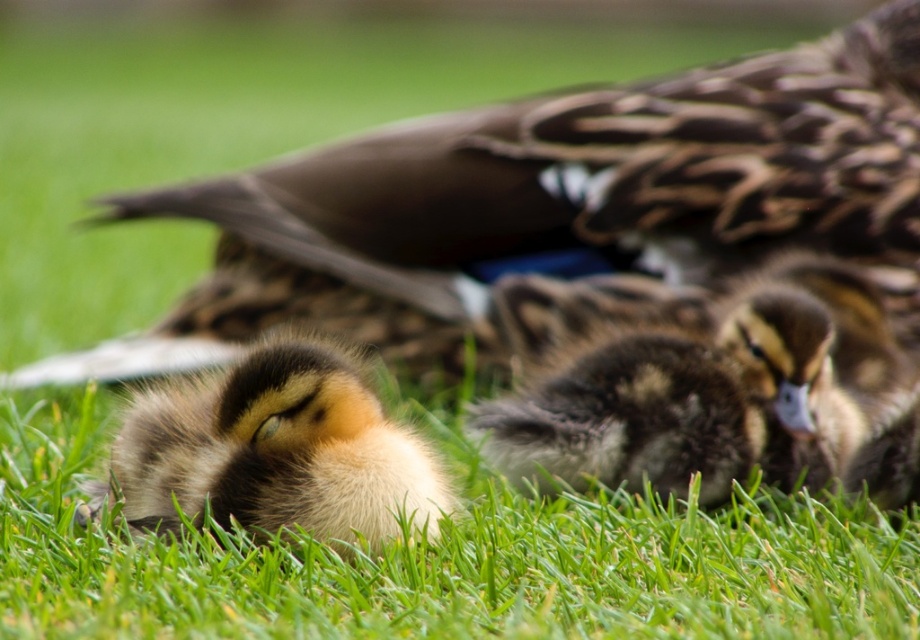
Question: Which of the following is the closest to the observer?

Choices:
 (A) (843, 460)
 (B) (273, 513)

Answer: (B)

Question: Which object appears farthest from the camera in this image?

Choices:
 (A) brown fluffy duckling at center
 (B) soft brown downy duckling at lower left

Answer: (A)

Question: Is brown fluffy duckling at center to the left of soft brown downy duckling at lower left from the viewer's perspective?

Choices:
 (A) no
 (B) yes

Answer: (A)

Question: Can you confirm if brown fluffy duckling at center is bigger than soft brown downy duckling at lower left?

Choices:
 (A) no
 (B) yes

Answer: (B)

Question: Is brown fluffy duckling at center wider than soft brown downy duckling at lower left?

Choices:
 (A) no
 (B) yes

Answer: (B)

Question: Which point is farther from the camera taking this photo?

Choices:
 (A) pos(691,412)
 (B) pos(259,442)

Answer: (A)